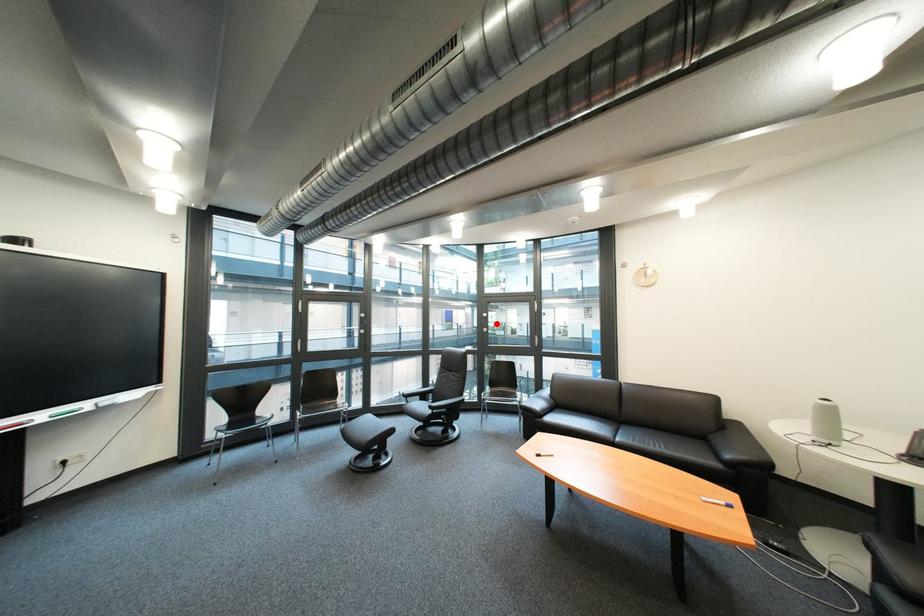
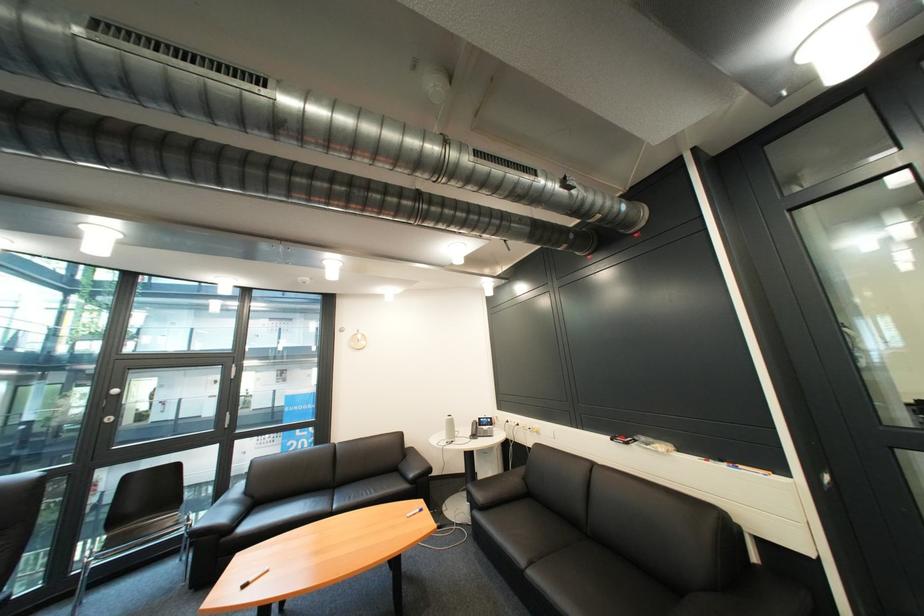
Question: A red point is marked in image1. In image2, is the corresponding 3D point closer to the camera or farther? Reply with the corresponding letter.

Choices:
 (A) The corresponding 3D point is closer.
 (B) The corresponding 3D point is farther.

Answer: (A)